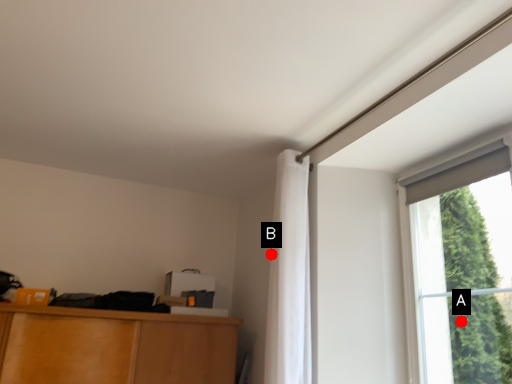
Question: Two points are circled on the image, labeled by A and B beside each circle. Among these points, which one is farthest from the camera?

Choices:
 (A) A is further
 (B) B is further

Answer: (A)